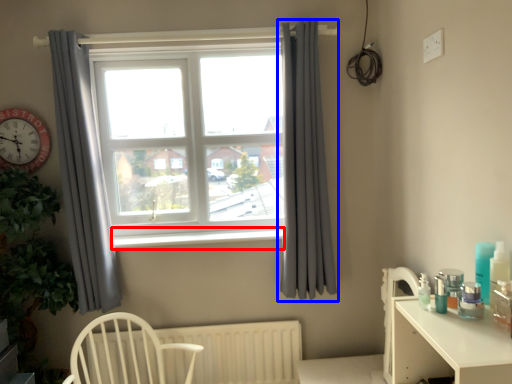
Question: Which object appears closest to the camera in this image, window sill (highlighted by a red box) or curtain (highlighted by a blue box)?

Choices:
 (A) window sill
 (B) curtain

Answer: (B)